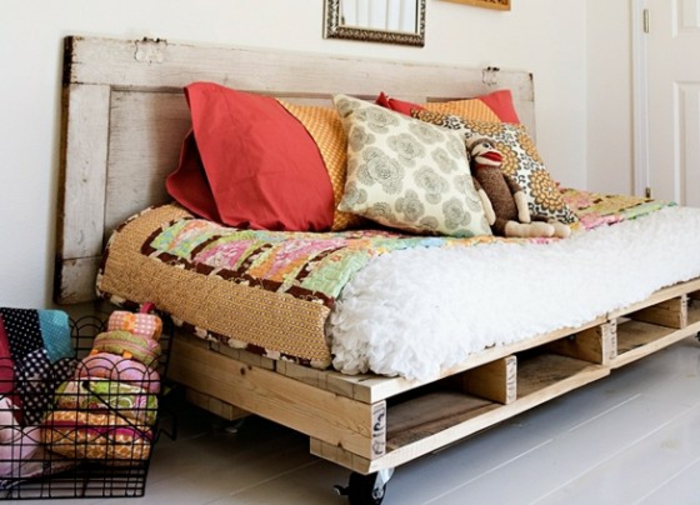
This screenshot has width=700, height=505. Identify the location of cubby holes. (694, 314), (648, 331), (558, 365), (452, 424).